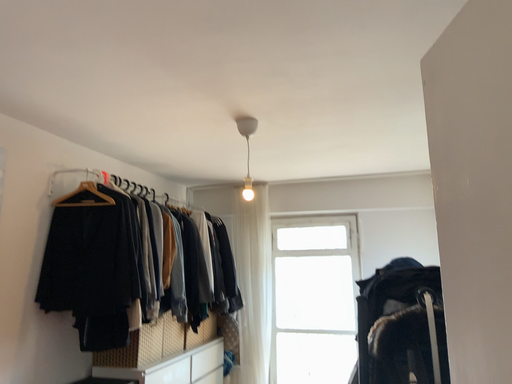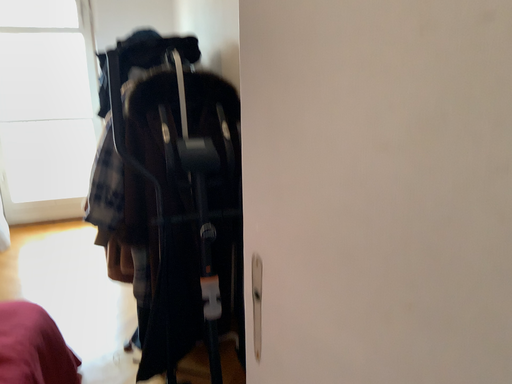
Question: Which way did the camera rotate in the video?

Choices:
 (A) rotated downward
 (B) rotated upward

Answer: (A)